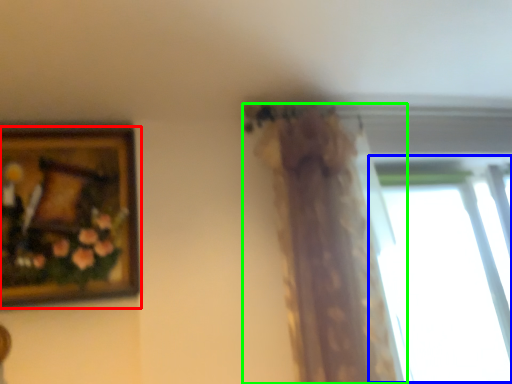
Question: Estimate the real-world distances between objects in this image. Which object is closer to picture frame (highlighted by a red box), window (highlighted by a blue box) or curtain (highlighted by a green box)?

Choices:
 (A) window
 (B) curtain

Answer: (B)